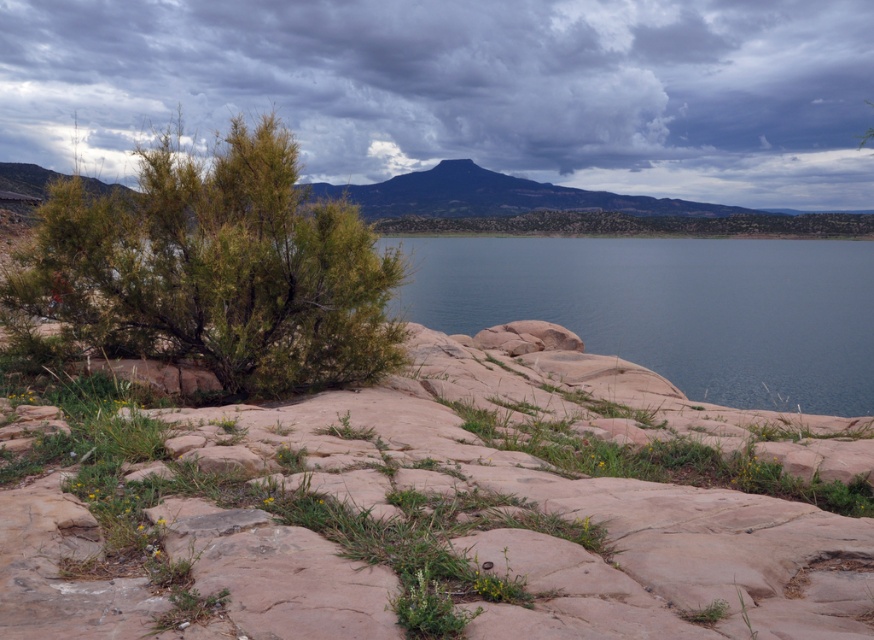
Which is above, cloudy sky at upper center or blue smooth water at center?

cloudy sky at upper center is higher up.

Does cloudy sky at upper center appear over blue smooth water at center?

Yes.

Identify the location of cloudy sky at upper center. This screenshot has height=640, width=874. (466, 90).

Find the location of a particular element. The image size is (874, 640). cloudy sky at upper center is located at coordinates (466, 90).

Is green leafy bush at left to the left of blue smooth water at center from the viewer's perspective?

Indeed, green leafy bush at left is positioned on the left side of blue smooth water at center.

Between green leafy bush at left and blue smooth water at center, which one appears on the left side from the viewer's perspective?

From the viewer's perspective, green leafy bush at left appears more on the left side.

I want to click on green leafy bush at left, so click(214, 269).

Is cloudy sky at upper center wider than green leafy bush at left?

Yes.

Between cloudy sky at upper center and green leafy bush at left, which one is positioned higher?

Positioned higher is cloudy sky at upper center.

You are a GUI agent. You are given a task and a screenshot of the screen. Output one action in this format:
    pyautogui.click(x=<x>, y=<y>)
    Task: Click on the cloudy sky at upper center
    
    Given the screenshot: What is the action you would take?
    pyautogui.click(x=466, y=90)

Where is `cloudy sky at upper center`? The width and height of the screenshot is (874, 640). cloudy sky at upper center is located at coordinates (466, 90).